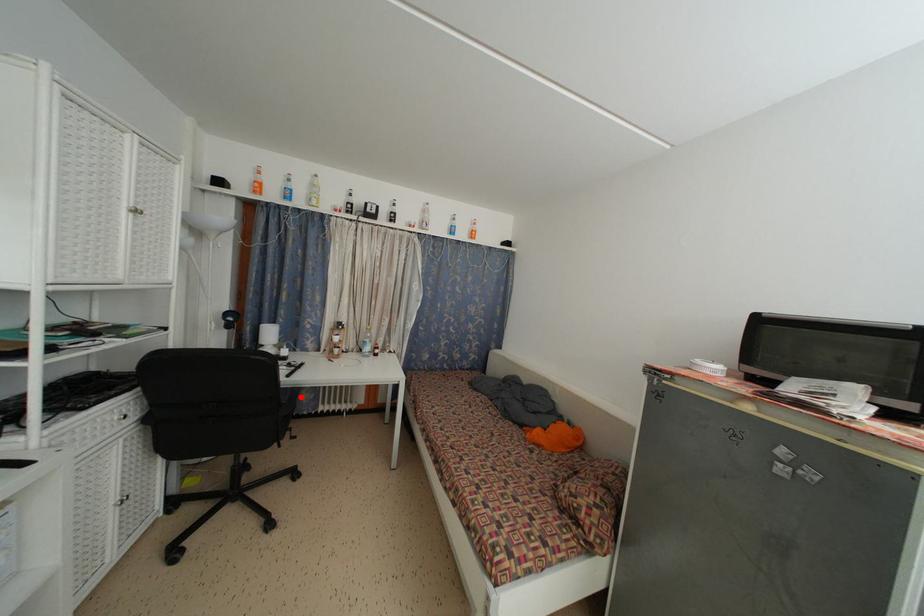
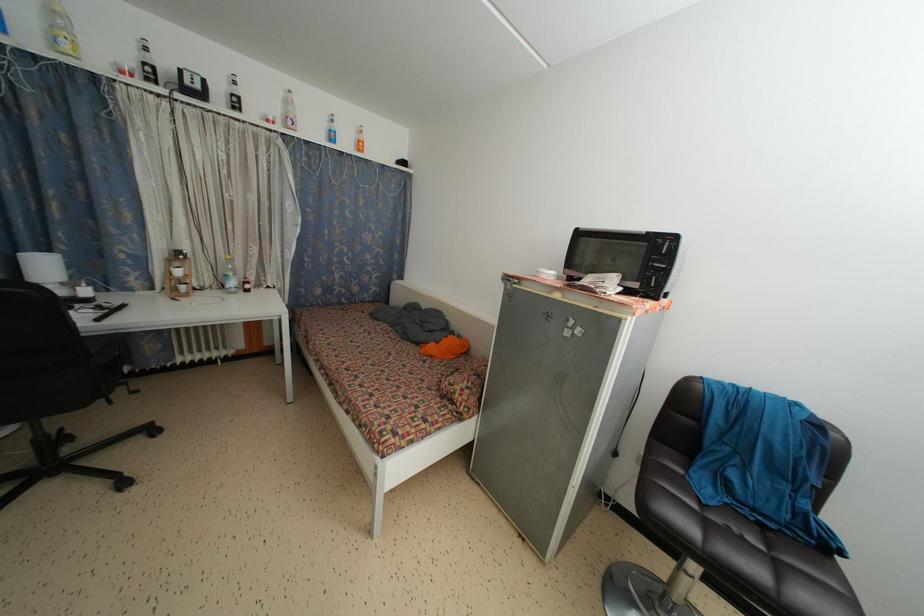
In the second image, find the point that corresponds to the highlighted location in the first image.

(127, 345)